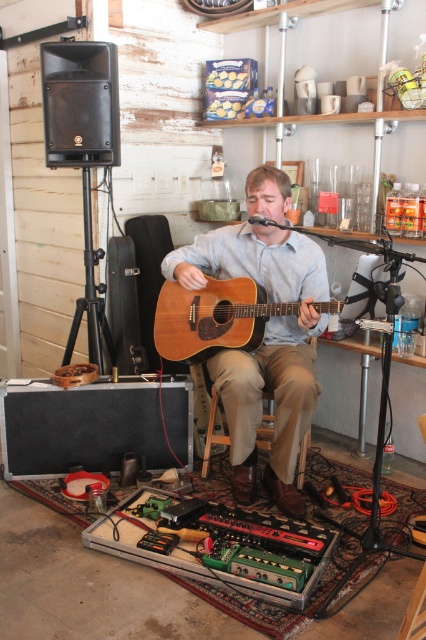
Between wooden acoustic guitar at center and natural wood acoustic guitar at center, which one appears on the left side from the viewer's perspective?

From the viewer's perspective, wooden acoustic guitar at center appears more on the left side.

Is wooden acoustic guitar at center in front of natural wood acoustic guitar at center?

No, wooden acoustic guitar at center is further to the viewer.

Is point (313, 269) more distant than point (195, 330)?

No, (313, 269) is in front of (195, 330).

Locate an element on the screen. The width and height of the screenshot is (426, 640). wooden acoustic guitar at center is located at coordinates (264, 348).